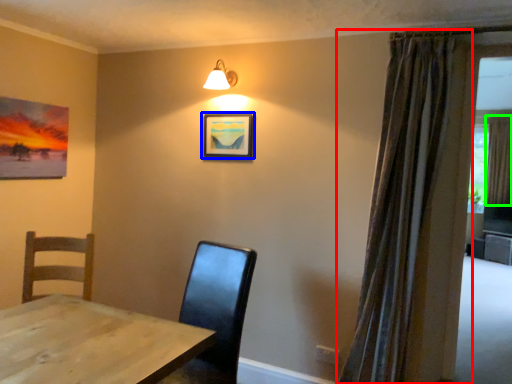
Question: Which object is the farthest from curtain (highlighted by a red box)? Choose among these: picture frame (highlighted by a blue box) or curtain (highlighted by a green box).

Choices:
 (A) picture frame
 (B) curtain

Answer: (B)